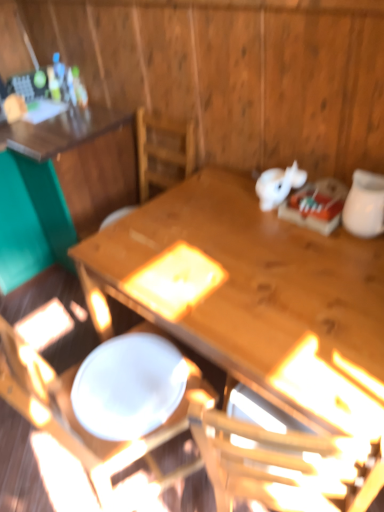
The height and width of the screenshot is (512, 384). In order to click on empty space that is ontop of white glossy plate at center (from a real-world perspective) in this screenshot , I will do `click(131, 369)`.